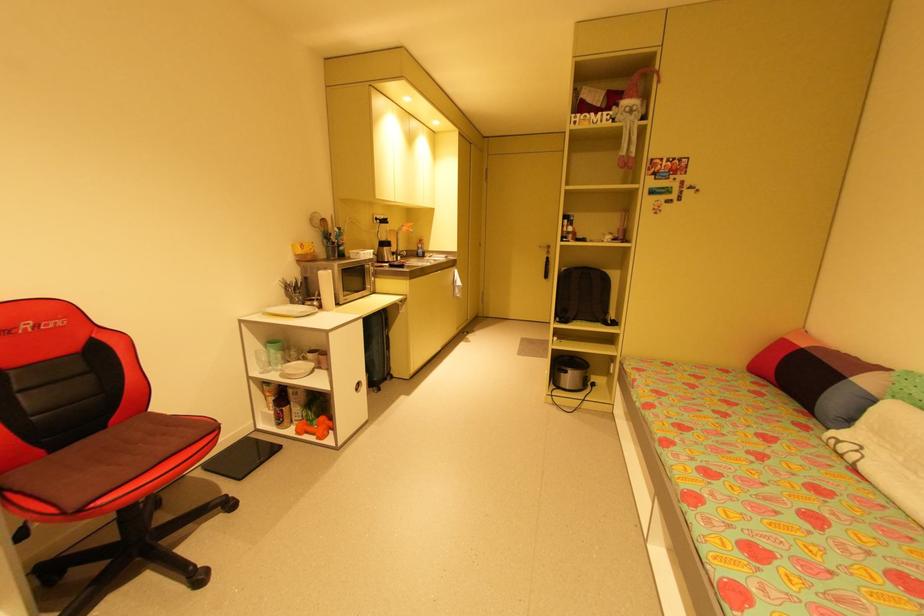
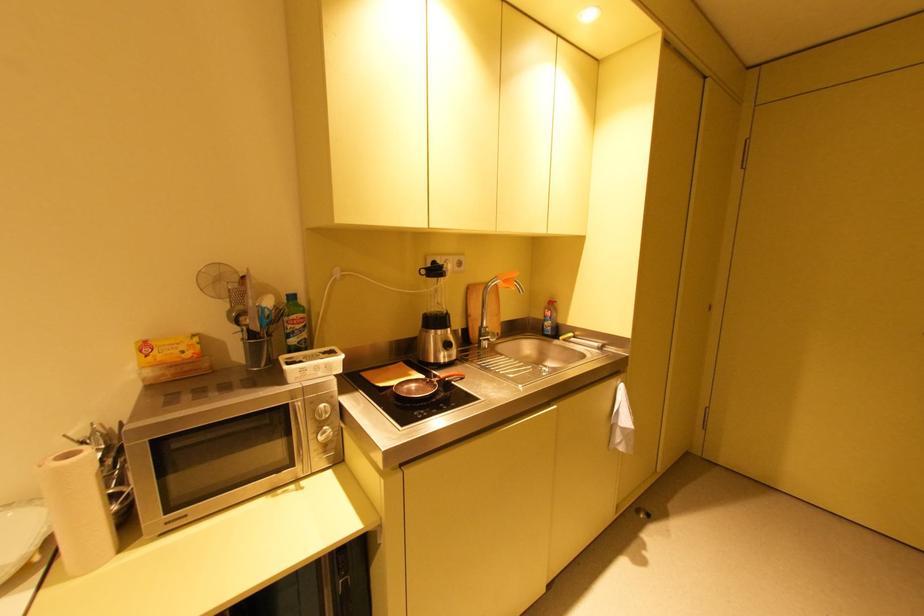
Where in the second image is the point corresponding to [307,246] from the first image?

(150, 347)